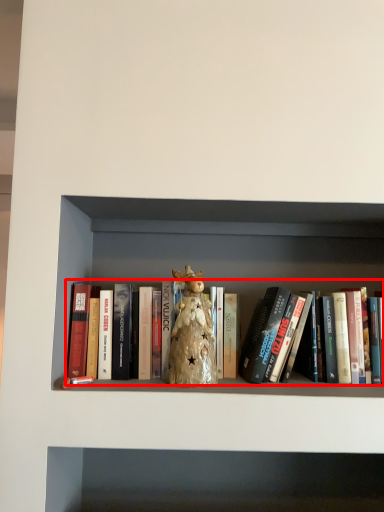
Question: From the image's perspective, where is book (annotated by the red box) located relative to toy?

Choices:
 (A) below
 (B) above

Answer: (A)